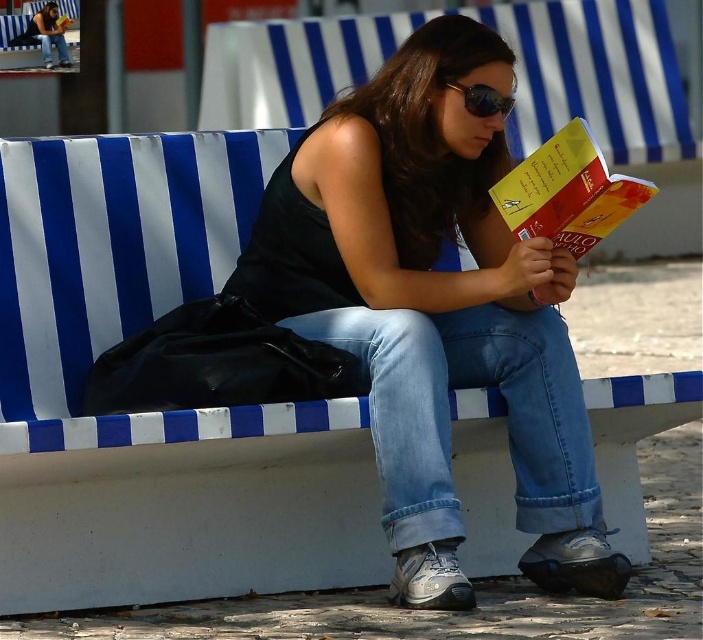
You are standing at the camera position and want to pick up the yellow paper at center. Can you reach it without moving your feet?

The yellow paper at center is 5.01 meters away from the camera, so you cannot reach it without moving your feet.

You are a delivery person who needs to place a small package on the bench where the woman is sitting. The package is 35 centimeters long. Can you fit it between the yellow paper at center and the sunglasses at center without moving either item?

The distance between the yellow paper at center and the sunglasses at center is 34.55 centimeters. Since the package is 35 centimeters long, it is slightly longer than the available space. Therefore, you cannot fit the package between them without moving either item.